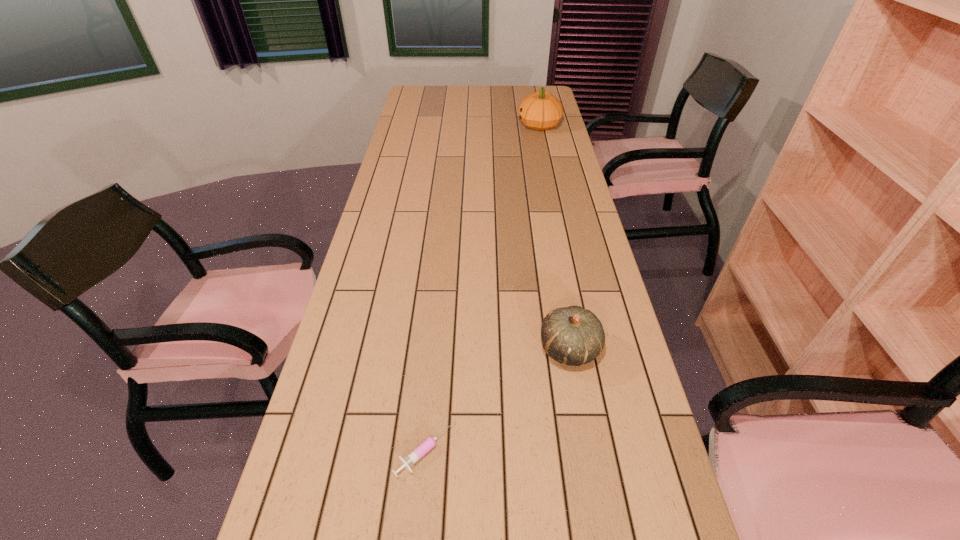
Find the location of `vacant space in between the tallest object and the shortest object`. vacant space in between the tallest object and the shortest object is located at coordinates (482, 288).

Locate an element on the screen. free space between the nearer gourd and the tallest object is located at coordinates (554, 237).

At what (x,y) coordinates should I click in order to perform the action: click on free space between the second nearest object and the farther gourd. Please return your answer as a coordinate pair (x, y). Looking at the image, I should click on (554, 237).

This screenshot has width=960, height=540. In order to click on free spot between the tallest object and the nearer gourd in this screenshot , I will do `click(554, 237)`.

Image resolution: width=960 pixels, height=540 pixels. Find the location of `vacant area that lies between the taller gourd and the syringe`. vacant area that lies between the taller gourd and the syringe is located at coordinates (482, 288).

Select which object appears as the closest to the second nearest object. Please provide its 2D coordinates. Your answer should be formatted as a tuple, i.e. [(x, y)], where the tuple contains the x and y coordinates of a point satisfying the conditions above.

[(421, 450)]

At what (x,y) coordinates should I click in order to perform the action: click on the closest object relative to the second nearest object. Please return your answer as a coordinate pair (x, y). The image size is (960, 540). Looking at the image, I should click on (421, 450).

This screenshot has height=540, width=960. I want to click on blank space that satisfies the following two spatial constraints: 1. on the side of the farther gourd with the carved face; 2. on the front side of the leftmost object, so click(x=610, y=450).

Image resolution: width=960 pixels, height=540 pixels. In order to click on vacant space that satisfies the following two spatial constraints: 1. on the side of the taller gourd with the carved face; 2. on the front side of the syringe in this screenshot , I will do `click(610, 450)`.

This screenshot has height=540, width=960. I want to click on free spot that satisfies the following two spatial constraints: 1. on the side of the taller gourd with the carved face; 2. on the front side of the second nearest object, so click(x=588, y=348).